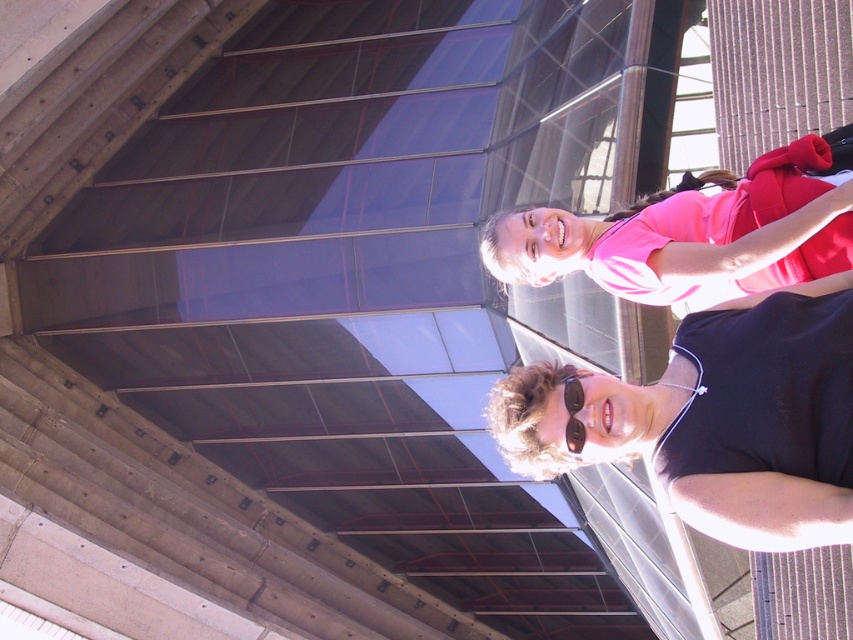
Question: Can you confirm if black matte sunglasses at lower right is positioned above pink fabric shirt at upper right?

Choices:
 (A) no
 (B) yes

Answer: (A)

Question: Is pink fabric shirt at upper right above black plastic goggles at lower center?

Choices:
 (A) no
 (B) yes

Answer: (B)

Question: Can you confirm if pink fabric shirt at upper right is smaller than black plastic goggles at lower center?

Choices:
 (A) no
 (B) yes

Answer: (A)

Question: Which object is farther from the camera taking this photo?

Choices:
 (A) pink fabric shirt at upper right
 (B) black matte sunglasses at lower right

Answer: (A)

Question: Which of the following is the farthest from the observer?

Choices:
 (A) (712, 250)
 (B) (694, 490)

Answer: (A)

Question: Which point is closer to the camera taking this photo?

Choices:
 (A) (579, 435)
 (B) (776, 394)

Answer: (B)